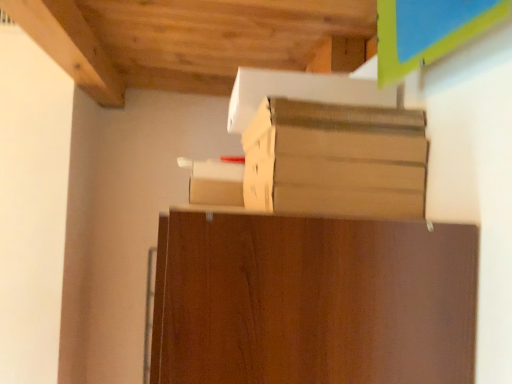
Describe the element at coordinates (312, 300) in the screenshot. I see `brown wood cabinet at center` at that location.

Identify the location of brown wood cabinet at center. (312, 300).

Image resolution: width=512 pixels, height=384 pixels. I want to click on brown wood cabinet at center, so click(312, 300).